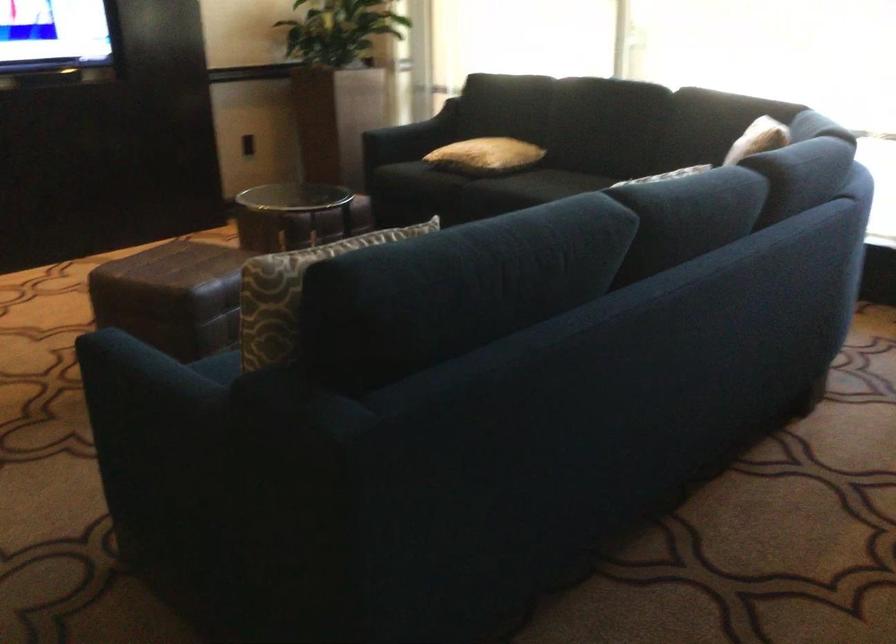
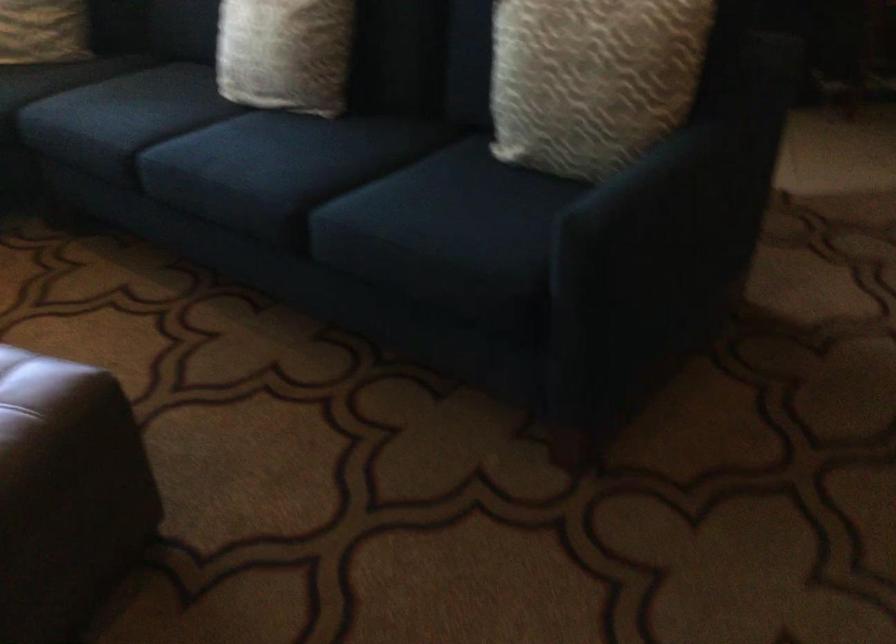
The point at (124, 398) is marked in the first image. Where is the corresponding point in the second image?

(687, 190)